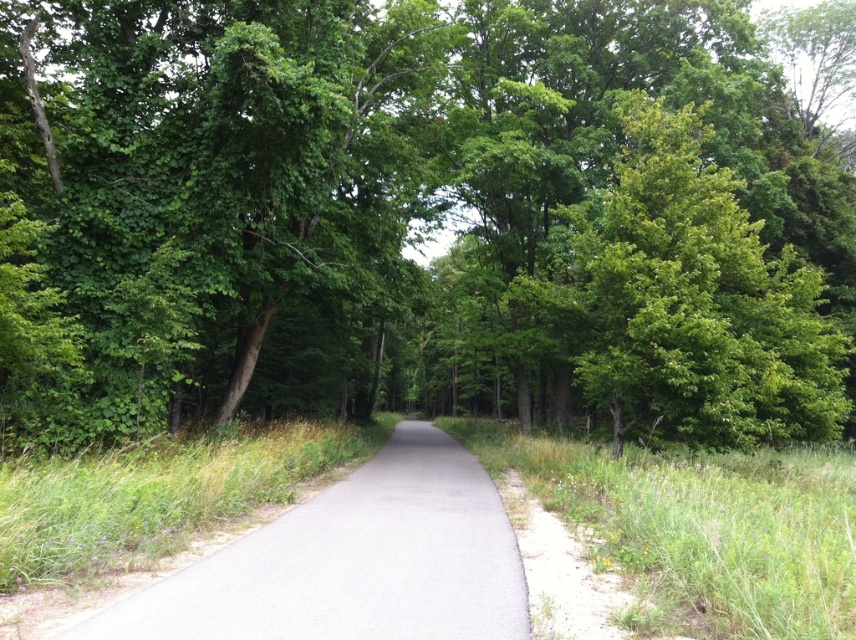
You are a hiker carrying a 2.5 meter wide tent. You need to set up camp along the gray asphalt path at center. Considering the green leafy tree at center, will the tree block the path enough to prevent you from placing your tent there?

The green leafy tree at center is wider than the gray asphalt path at center. Since the tree is wider than the path itself, it would likely block part of the path, making it difficult to place a 2.5 meter wide tent without obstruction. Choose another location for your campsite.

You are standing on the forest path and want to reach a destination located at point (599, 538). There is another point at (296, 625) in front of you. Which point should you head towards first to reach your destination?

You should head towards point (599, 538) first because it is your destination and point (296, 625) is in front of it, meaning it is closer to you than the destination.